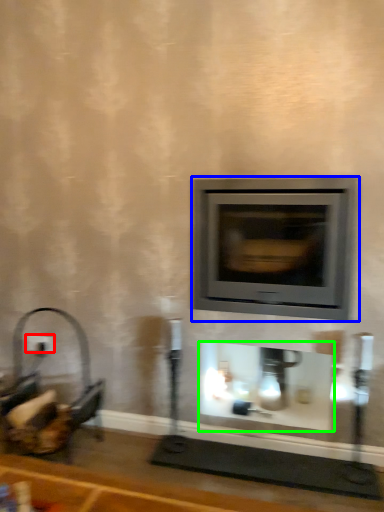
Question: Based on their relative distances, which object is nearer to electric outlet (highlighted by a red box)? Choose from wood burning stove (highlighted by a blue box) and fireplace (highlighted by a green box).

Choices:
 (A) wood burning stove
 (B) fireplace

Answer: (B)